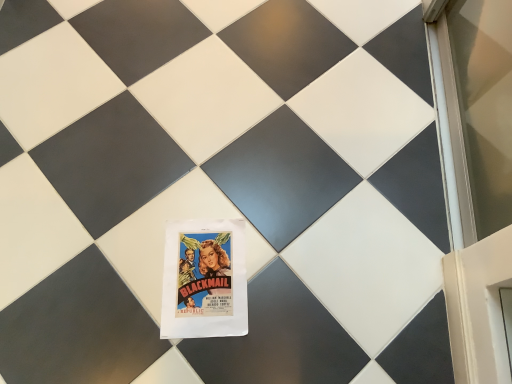
This screenshot has width=512, height=384. What are the coordinates of `free space underneath matte paper poster at center (from a real-world perspective)` in the screenshot? It's located at (207, 269).